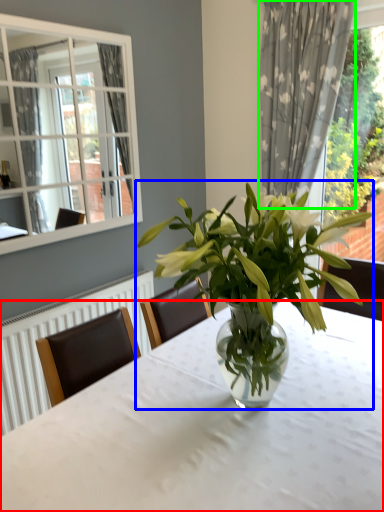
Question: Which object is the farthest from table (highlighted by a red box)? Choose among these: houseplant (highlighted by a blue box) or curtain (highlighted by a green box).

Choices:
 (A) houseplant
 (B) curtain

Answer: (B)